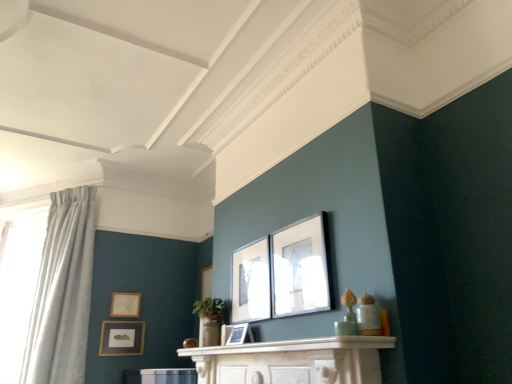
Question: Is point (25, 349) positioned closer to the camera than point (326, 340)?

Choices:
 (A) farther
 (B) closer

Answer: (A)

Question: Is light blue fabric curtain at left taller or shorter than white marble mantle at center?

Choices:
 (A) short
 (B) tall

Answer: (B)

Question: Which object is the farthest from the matte gold picture frame at upper left, marked as the fifth picture frame in a front-to-back arrangement?

Choices:
 (A) matte black picture frame at center, arranged as the 3th picture frame when viewed from the back
 (B) matte black picture frame at upper center, the 1th picture frame viewed from the right
 (C) white marble mantle at center
 (D) matte black picture frame at lower left, which is the second picture frame from left to right
 (E) light blue fabric curtain at left

Answer: (B)

Question: Based on their relative distances, which object is nearer to the light blue fabric curtain at left?

Choices:
 (A) matte black picture frame at lower left, which is the second picture frame from left to right
 (B) matte black picture frame at center, the 3th picture frame in the front-to-back sequence
 (C) matte black picture frame at center, placed as the second picture frame when sorted from right to left
 (D) matte black picture frame at upper center, placed as the fifth picture frame when sorted from left to right
 (E) white sheer curtain at left

Answer: (E)